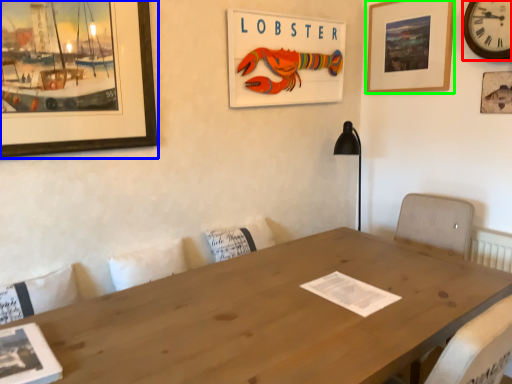
Question: Which object is the farthest from clock (highlighted by a red box)? Choose among these: picture frame (highlighted by a blue box) or picture frame (highlighted by a green box).

Choices:
 (A) picture frame
 (B) picture frame

Answer: (A)